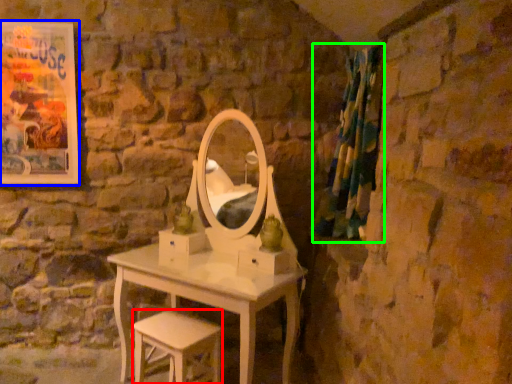
Question: Which is nearer to the stool (highlighted by a red box)? picture frame (highlighted by a blue box) or curtain (highlighted by a green box).

Choices:
 (A) picture frame
 (B) curtain

Answer: (B)